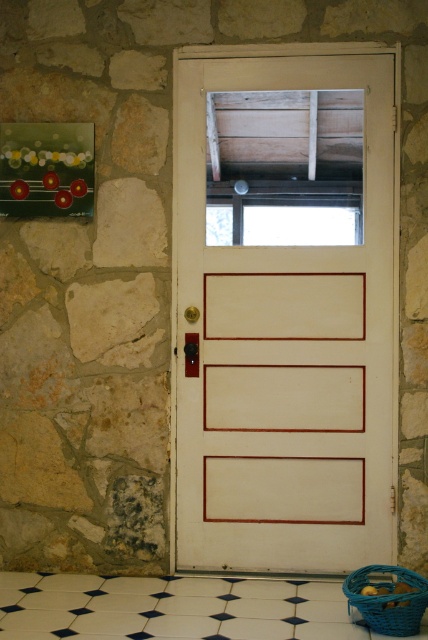
Which is more to the left, white glossy tile at lower center or blue woven basket at lower right?

white glossy tile at lower center is more to the left.

Measure the distance between white glossy tile at lower center and camera.

white glossy tile at lower center is 3.19 meters from camera.

What do you see at coordinates (172, 609) in the screenshot?
I see `white glossy tile at lower center` at bounding box center [172, 609].

The height and width of the screenshot is (640, 428). In order to click on white glossy tile at lower center in this screenshot , I will do `click(172, 609)`.

Does white painted wood door at center appear over blue woven basket at lower right?

Correct, white painted wood door at center is located above blue woven basket at lower right.

The width and height of the screenshot is (428, 640). I want to click on white painted wood door at center, so click(x=285, y=346).

At what (x,y) coordinates should I click in order to perform the action: click on white painted wood door at center. Please return your answer as a coordinate pair (x, y). Looking at the image, I should click on point(285,346).

Who is positioned more to the left, white painted wood door at center or white glossy tile at lower center?

From the viewer's perspective, white glossy tile at lower center appears more on the left side.

Which is below, white painted wood door at center or white glossy tile at lower center?

Positioned lower is white glossy tile at lower center.

Locate an element on the screen. white painted wood door at center is located at coordinates pos(285,346).